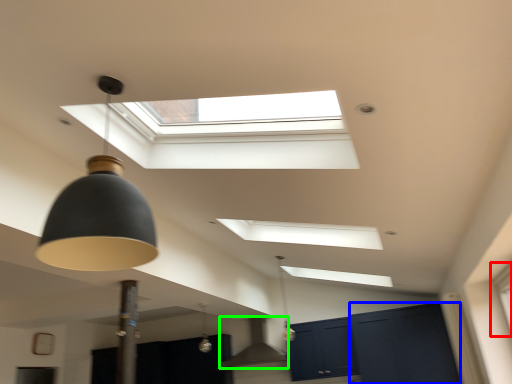
Question: Estimate the real-world distances between objects in this image. Which object is closer to window (highlighted by a red box), glass door (highlighted by a blue box) or exhaust hood (highlighted by a green box)?

Choices:
 (A) glass door
 (B) exhaust hood

Answer: (A)